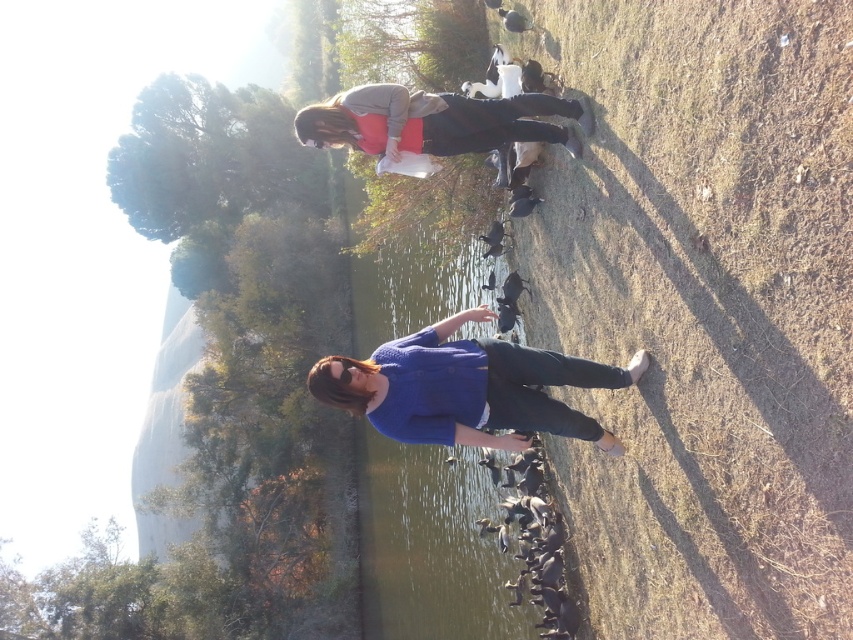
You are standing at the edge of the water in the scene. There is a point marked at coordinates (x=431, y=547). What does this point represent?

The point at coordinates (x=431, y=547) indicates clear water at center.

You are standing at the edge of the water and want to walk towards the matte gray sweater at upper center without stepping into the clear water at center. Which direction should you move?

You should move to the right because the clear water at center is to the left of the matte gray sweater at upper center, so moving right would avoid stepping into the water.